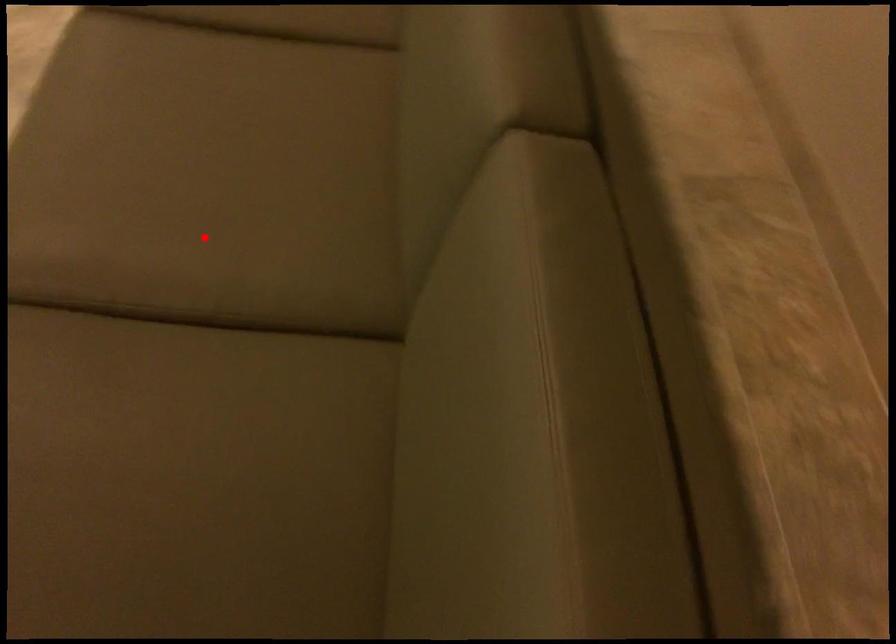
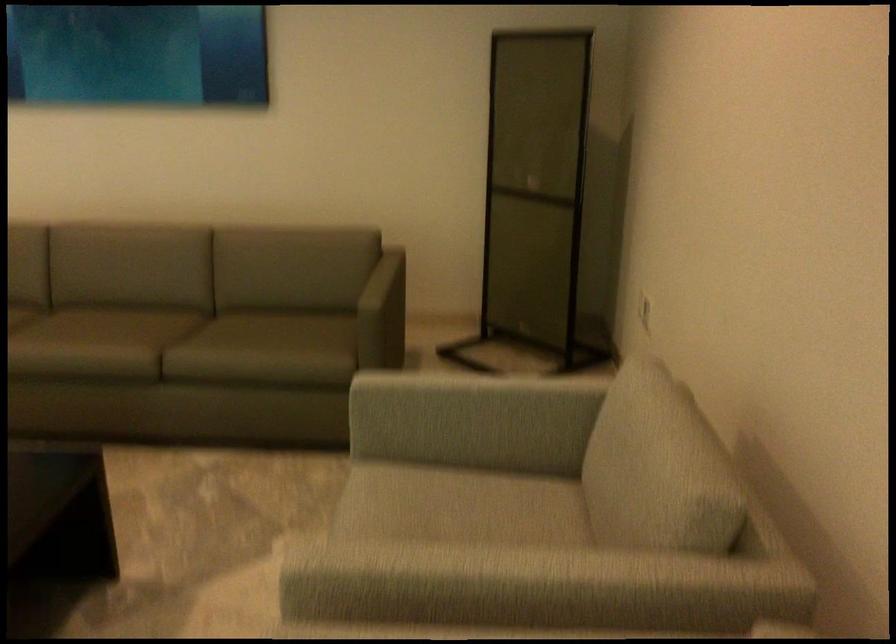
Question: I am providing you with two images of the same scene from different viewpoints. A red point is marked on the first image. Can you still see the location of the red point in image 2?

Choices:
 (A) Yes
 (B) No

Answer: (A)